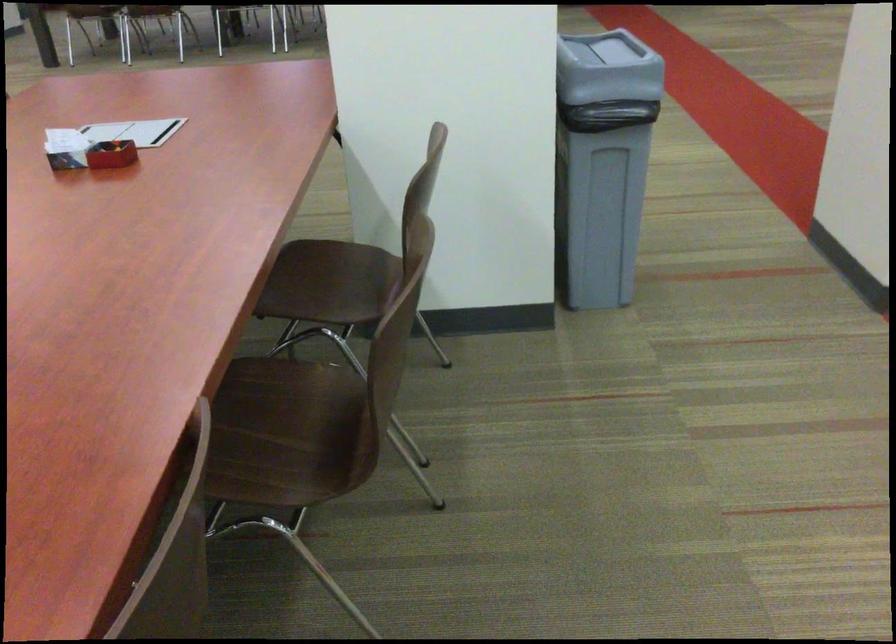
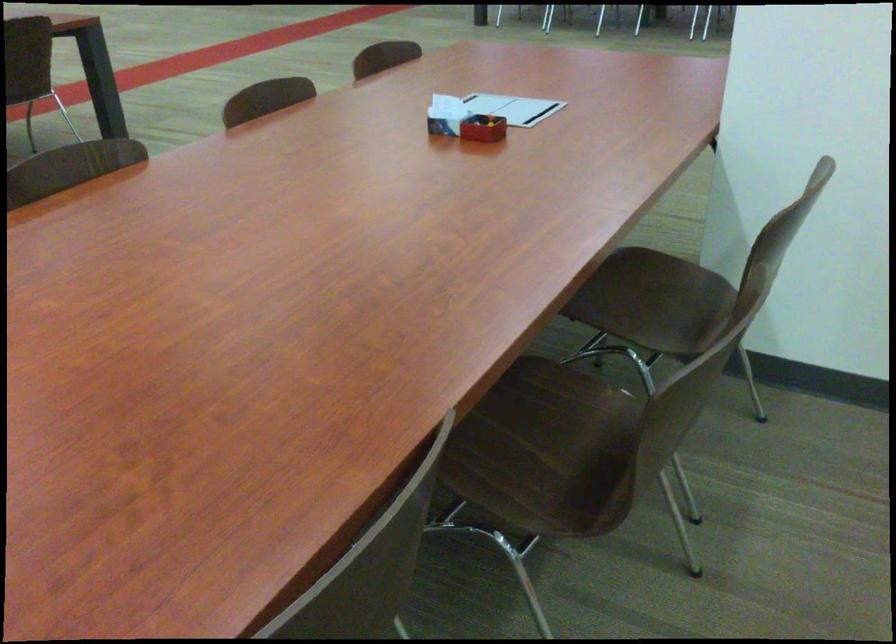
Where in the second image is the point corresponding to point 321,277 from the first image?

(644, 289)